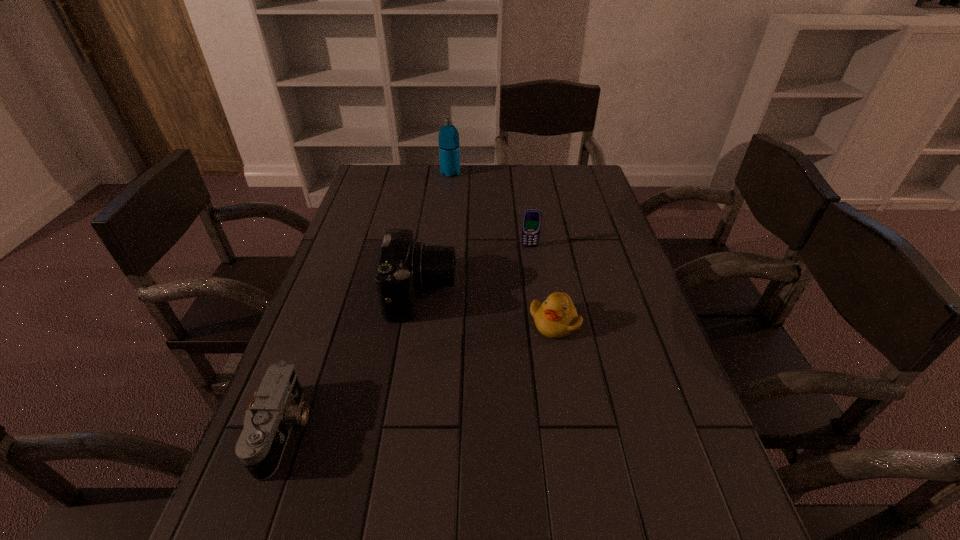
The width and height of the screenshot is (960, 540). What are the coordinates of `object identified as the fourth closest to the duckling` in the screenshot? It's located at (449, 147).

Choose which object is the nearest neighbor to the duckling. Please provide its 2D coordinates. Your answer should be formatted as a tuple, i.e. [(x, y)], where the tuple contains the x and y coordinates of a point satisfying the conditions above.

[(404, 266)]

Image resolution: width=960 pixels, height=540 pixels. What are the coordinates of `free space that satisfies the following two spatial constraints: 1. on the front-facing side of the second farthest object; 2. on the lens of the taller camera` in the screenshot? It's located at (536, 293).

Where is `vacant space that satisfies the following two spatial constraints: 1. on the front side of the tallest object; 2. on the lens of the shorter camera`? This screenshot has height=540, width=960. vacant space that satisfies the following two spatial constraints: 1. on the front side of the tallest object; 2. on the lens of the shorter camera is located at coordinates (423, 430).

Identify the location of blank space that satisfies the following two spatial constraints: 1. on the front side of the tallest object; 2. on the lens of the leftmost object. This screenshot has height=540, width=960. point(423,430).

Locate an element on the screen. free space that satisfies the following two spatial constraints: 1. on the front side of the farthest object; 2. on the lens of the fourth shortest object is located at coordinates (438, 293).